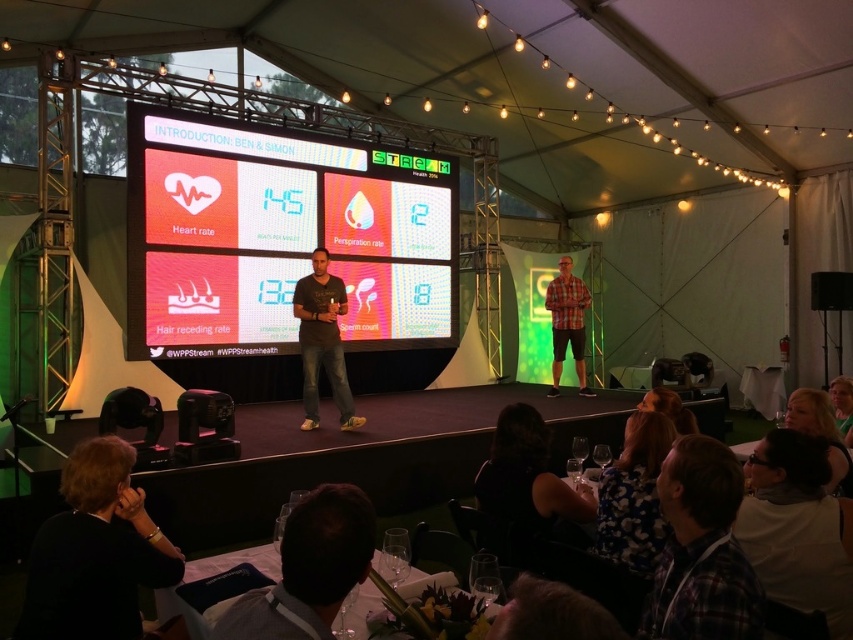
You are an attendee at the event and want to approach the presenter wearing the plaid fabric shirt at lower right. Which direction should you move from the black fabric at lower center to reach them?

The plaid fabric shirt at lower right is closer to the viewer than the black fabric at lower center, so you should move towards the direction where the plaid fabric shirt at lower right is located, which is to the right side of the stage.

You are an attendee at this event and want to sit down between the black fabric at lower center and the floral fabric dress at lower center. Can you comfortably fit between them if you need 12 inches of space to sit?

The black fabric at lower center is 10.93 inches from floral fabric dress at lower center. Since the required space is 12 inches, you cannot comfortably fit between them.

You are sitting in the audience facing the stage. There are two points marked on the screen. Which point is closer to you, point 1 at coordinates (543,488) or point 2 at coordinates (625,548)?

Point 2 at coordinates (625,548) is closer to you because it is closer to the camera than point 1 at coordinates (543,488).